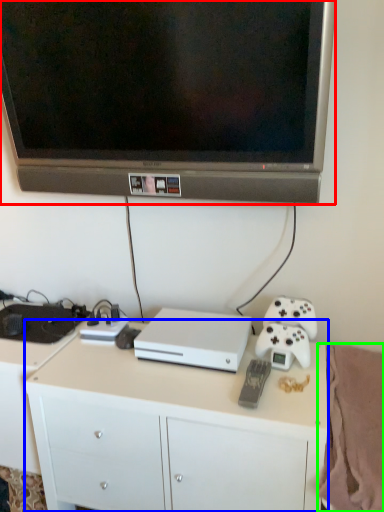
Question: Estimate the real-world distances between objects in this image. Which object is farther from television (highlighted by a red box), desk (highlighted by a blue box) or blanket (highlighted by a green box)?

Choices:
 (A) desk
 (B) blanket

Answer: (B)